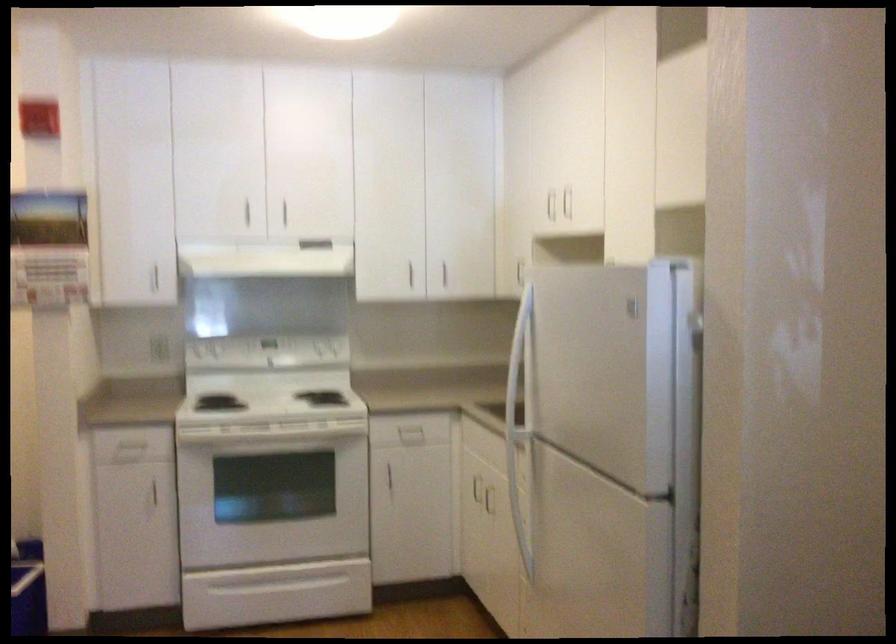
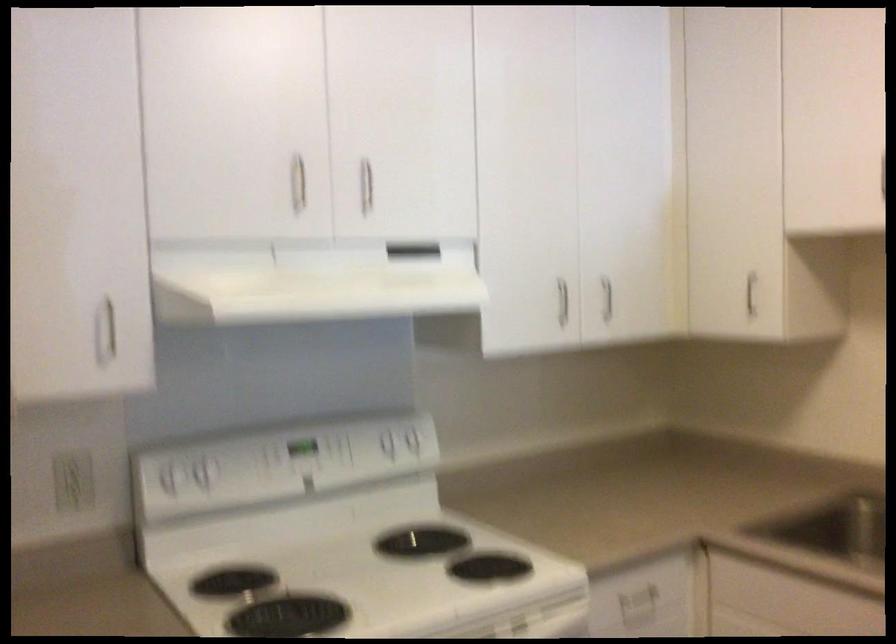
In the second image, find the point that corresponds to the point at 211,346 in the first image.

(200, 474)